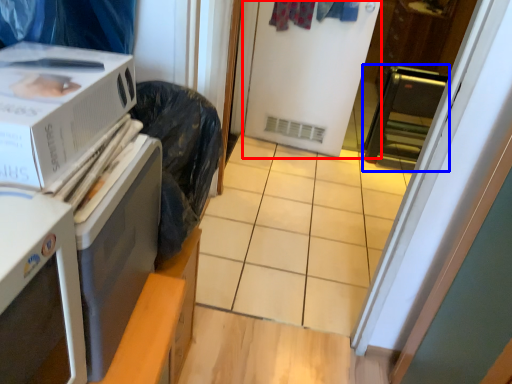
Question: Which object is closer to the camera taking this photo, screen door (highlighted by a red box) or appliance (highlighted by a blue box)?

Choices:
 (A) screen door
 (B) appliance

Answer: (A)